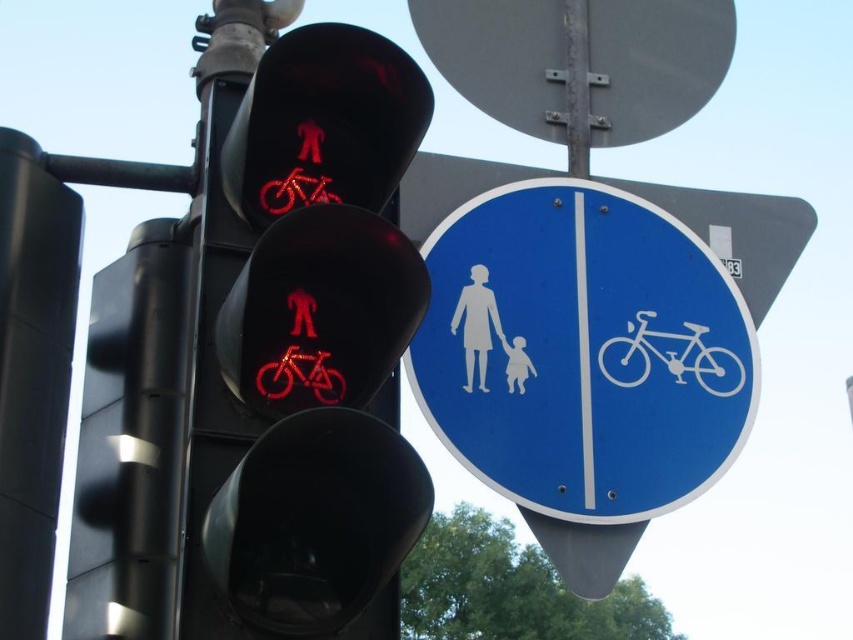
You are a delivery person who needs to park your blue plastic bicycle at center near the traffic signal. There is a white matte figure at center nearby. Which object should you place your bicycle closer to, considering their sizes?

The blue plastic bicycle at center is larger than the white matte figure at center, so you should place it closer to the white matte figure at center to ensure there is enough space.

You are a city planner analyzing traffic signals. You observe the white matte bicycle at center and the white matte figure at center on the traffic signal. Which symbol is wider?

The white matte bicycle at center is wider than the white matte figure at center.